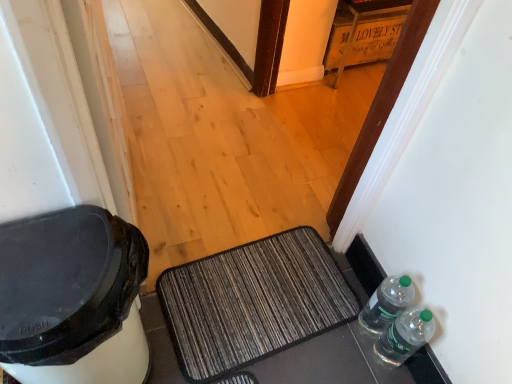
Where is `blank space situated above textured gray doormat at center (from a real-world perspective)`? blank space situated above textured gray doormat at center (from a real-world perspective) is located at coordinates (258, 287).